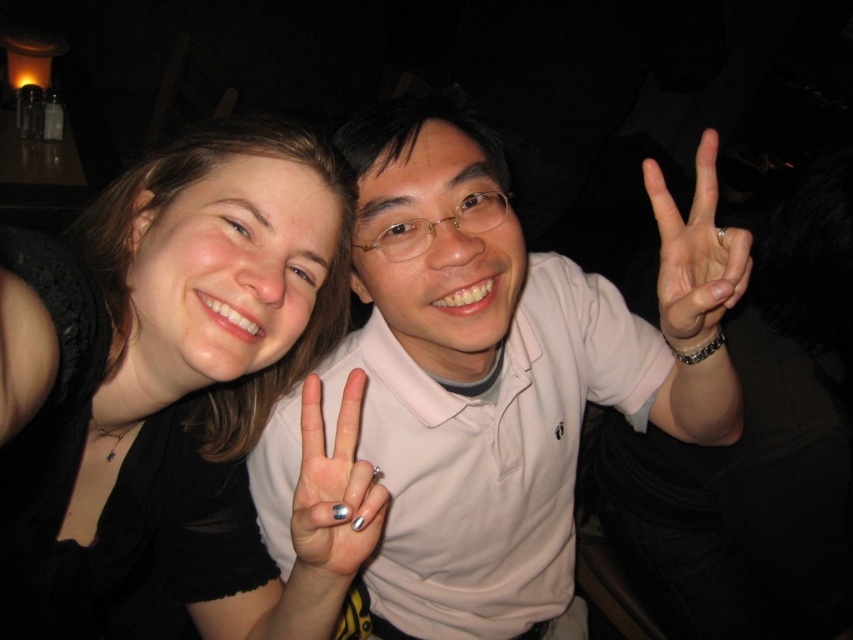
Is silver metallic nails at center bigger than white matte hand at center?

Incorrect, silver metallic nails at center is not larger than white matte hand at center.

Describe the element at coordinates (334, 492) in the screenshot. I see `silver metallic nails at center` at that location.

Where is `silver metallic nails at center`? silver metallic nails at center is located at coordinates (334, 492).

Who is more forward, (323, 486) or (364, 520)?

Point (323, 486) is in front.

Is black matte shirt at center below silver metallic nails at center?

Actually, black matte shirt at center is above silver metallic nails at center.

Does point (204, 496) come in front of point (343, 452)?

No, it is behind (343, 452).

You are a GUI agent. You are given a task and a screenshot of the screen. Output one action in this format:
    pyautogui.click(x=<x>, y=<y>)
    Task: Click on the black matte shirt at center
    Image resolution: width=853 pixels, height=640 pixels.
    Given the screenshot: What is the action you would take?
    pyautogui.click(x=178, y=394)

Does black matte shirt at center appear on the left side of white matte shirt at center?

Indeed, black matte shirt at center is positioned on the left side of white matte shirt at center.

Can you confirm if black matte shirt at center is smaller than white matte shirt at center?

Indeed, black matte shirt at center has a smaller size compared to white matte shirt at center.

Where is `black matte shirt at center`? This screenshot has height=640, width=853. black matte shirt at center is located at coordinates (178, 394).